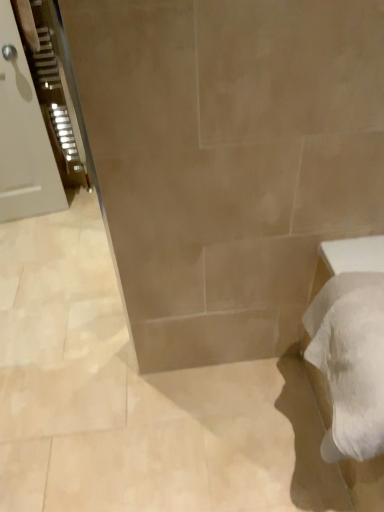
Question: Considering the relative positions of white fluffy bath towel at lower right and matte white door at left in the image provided, is white fluffy bath towel at lower right to the right of matte white door at left from the viewer's perspective?

Choices:
 (A) no
 (B) yes

Answer: (B)

Question: Does white fluffy bath towel at lower right have a smaller size compared to matte white door at left?

Choices:
 (A) no
 (B) yes

Answer: (A)

Question: Does white fluffy bath towel at lower right have a greater width compared to matte white door at left?

Choices:
 (A) yes
 (B) no

Answer: (A)

Question: Can we say white fluffy bath towel at lower right lies outside matte white door at left?

Choices:
 (A) yes
 (B) no

Answer: (A)

Question: Is the surface of white fluffy bath towel at lower right in direct contact with matte white door at left?

Choices:
 (A) yes
 (B) no

Answer: (B)

Question: From the image's perspective, would you say white fluffy bath towel at lower right is positioned over matte white door at left?

Choices:
 (A) yes
 (B) no

Answer: (B)

Question: Is matte white door at left shorter than white fluffy bath towel at lower right?

Choices:
 (A) no
 (B) yes

Answer: (A)

Question: Is matte white door at left completely or partially outside of white fluffy bath towel at lower right?

Choices:
 (A) yes
 (B) no

Answer: (A)

Question: Does matte white door at left have a smaller size compared to white fluffy bath towel at lower right?

Choices:
 (A) yes
 (B) no

Answer: (A)

Question: Considering the relative sizes of matte white door at left and white fluffy bath towel at lower right in the image provided, is matte white door at left wider than white fluffy bath towel at lower right?

Choices:
 (A) yes
 (B) no

Answer: (B)

Question: From a real-world perspective, is matte white door at left below white fluffy bath towel at lower right?

Choices:
 (A) yes
 (B) no

Answer: (B)

Question: Can you confirm if matte white door at left is positioned to the left of white fluffy bath towel at lower right?

Choices:
 (A) yes
 (B) no

Answer: (A)

Question: Is matte white door at left spatially inside white fluffy bath towel at lower right, or outside of it?

Choices:
 (A) outside
 (B) inside

Answer: (A)